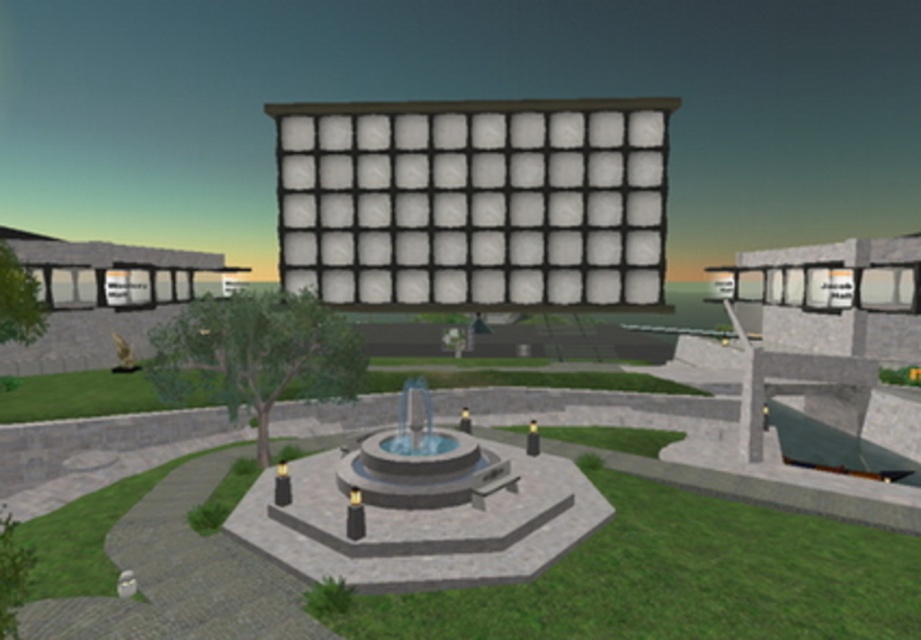
Question: Can you confirm if smooth gray fountain at center is wider than clear glass fountain at center?

Choices:
 (A) no
 (B) yes

Answer: (A)

Question: Which point is closer to the camera?

Choices:
 (A) (296, 472)
 (B) (430, 500)

Answer: (B)

Question: Does smooth gray fountain at center appear under clear glass fountain at center?

Choices:
 (A) no
 (B) yes

Answer: (B)

Question: Which object is farther from the camera taking this photo?

Choices:
 (A) clear glass fountain at center
 (B) smooth gray fountain at center

Answer: (B)

Question: Can you confirm if smooth gray fountain at center is positioned to the right of clear glass fountain at center?

Choices:
 (A) no
 (B) yes

Answer: (A)